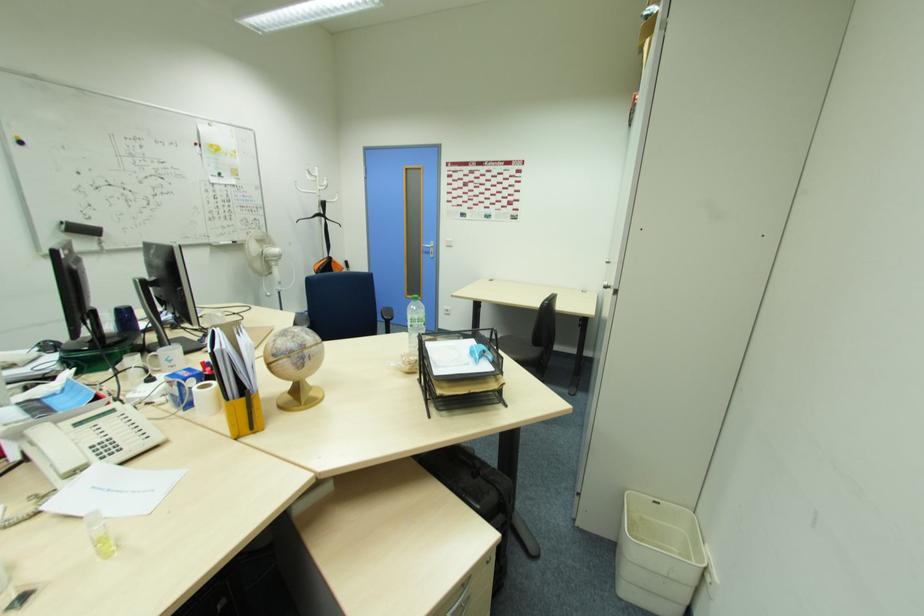
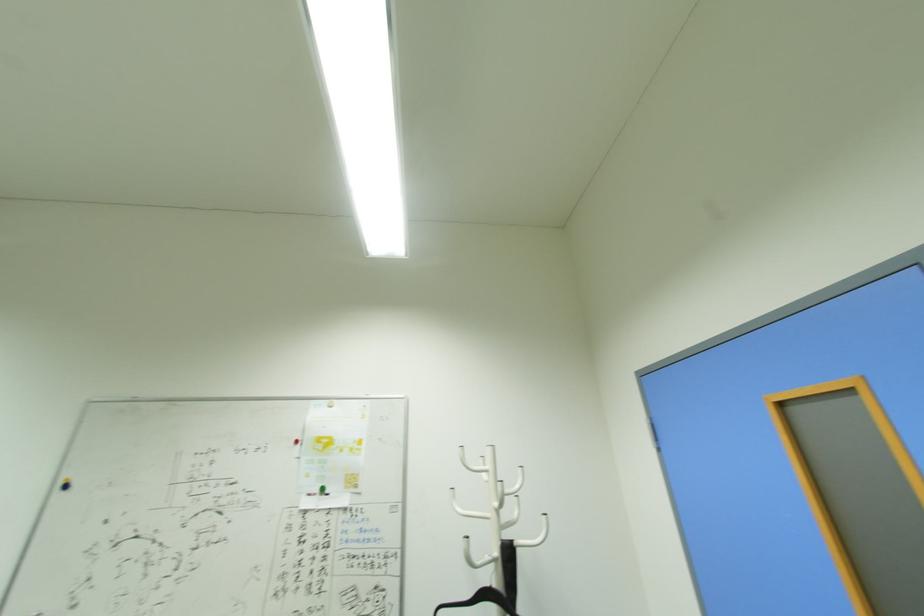
In the second image, find the point that corresponds to point (321, 169) in the first image.

(493, 451)